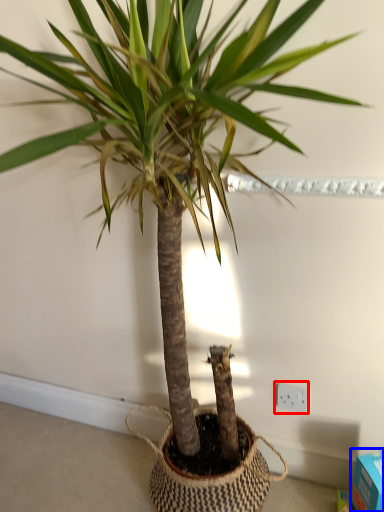
Question: Which of the following is the closest to the observer, electric outlet (highlighted by a red box) or box (highlighted by a blue box)?

Choices:
 (A) electric outlet
 (B) box

Answer: (B)